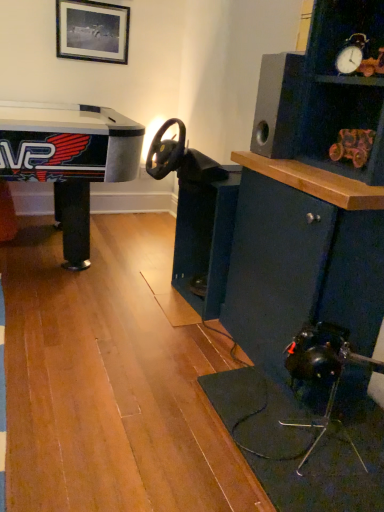
Image resolution: width=384 pixels, height=512 pixels. What do you see at coordinates (92, 31) in the screenshot?
I see `black matte picture frame at upper center` at bounding box center [92, 31].

The image size is (384, 512). Describe the element at coordinates (205, 239) in the screenshot. I see `dark blue wood cabinet at center` at that location.

The height and width of the screenshot is (512, 384). Describe the element at coordinates (278, 105) in the screenshot. I see `black matte speaker at upper right` at that location.

Where is `black matte speaker at upper right`? black matte speaker at upper right is located at coordinates (278, 105).

In order to click on black matte picture frame at upper center in this screenshot , I will do `click(92, 31)`.

From the picture: Is black matte speaker at upper right oriented towards dark blue wood cabinet at center?

No.

Is black matte speaker at upper right with dark blue wood cabinet at center?

They are not placed beside each other.

From the image's perspective, is black matte speaker at upper right located above dark blue wood cabinet at center?

Yes, from the image's perspective, black matte speaker at upper right is on top of dark blue wood cabinet at center.

From a real-world perspective, is black matte speaker at upper right on dark blue wood cabinet at center?

Yes.

From the image's perspective, does dark blue wood cabinet at center appear higher than black matte speaker at upper right?

Incorrect, from the image's perspective, dark blue wood cabinet at center is lower than black matte speaker at upper right.

Is dark blue wood cabinet at center turned away from black matte speaker at upper right?

dark blue wood cabinet at center does not have its back to black matte speaker at upper right.

Between dark blue wood cabinet at center and black matte speaker at upper right, which one has less height?

With less height is black matte speaker at upper right.

From a real-world perspective, is dark blue wood cabinet at center located higher than black matte speaker at upper right?

No.

Which is more to the right, black matte speaker at upper right or wooden toy car at upper right?

wooden toy car at upper right is more to the right.

Is black matte speaker at upper right located outside wooden toy car at upper right?

black matte speaker at upper right is positioned outside wooden toy car at upper right.

At what (x,y) coordinates should I click in order to perform the action: click on toy directly beneath the black matte speaker at upper right (from a real-world perspective). Please return your answer as a coordinate pair (x, y). The image size is (384, 512). Looking at the image, I should click on (353, 146).

Which is behind, black matte speaker at upper right or wooden toy car at upper right?

black matte speaker at upper right is further away from the camera.

Is dark blue wood cabinet at center far away from black matte picture frame at upper center?

Absolutely, dark blue wood cabinet at center is distant from black matte picture frame at upper center.

Can you confirm if dark blue wood cabinet at center is wider than black matte picture frame at upper center?

Correct, the width of dark blue wood cabinet at center exceeds that of black matte picture frame at upper center.

From the image's perspective, is dark blue wood cabinet at center on black matte picture frame at upper center?

No, from the image's perspective, dark blue wood cabinet at center is not on top of black matte picture frame at upper center.

Is black matte speaker at upper right shorter than black matte picture frame at upper center?

In fact, black matte speaker at upper right may be taller than black matte picture frame at upper center.

From the image's perspective, between black matte speaker at upper right and black matte picture frame at upper center, who is located below?

black matte speaker at upper right.

In terms of size, does black matte speaker at upper right appear bigger or smaller than black matte picture frame at upper center?

In the image, black matte speaker at upper right appears to be larger than black matte picture frame at upper center.

At what (x,y) coordinates should I click in order to perform the action: click on picture frame on the left of black matte speaker at upper right. Please return your answer as a coordinate pair (x, y). This screenshot has height=512, width=384. Looking at the image, I should click on (92, 31).

Is black matte picture frame at upper center located outside black matte speaker at upper right?

Yes, black matte picture frame at upper center is located beyond the bounds of black matte speaker at upper right.

Can you confirm if black matte picture frame at upper center is bigger than black matte speaker at upper right?

No, black matte picture frame at upper center is not bigger than black matte speaker at upper right.

From the image's perspective, which object appears higher, black matte picture frame at upper center or black matte speaker at upper right?

black matte picture frame at upper center.

In the scene shown: From a real-world perspective, between black matte picture frame at upper center and black matte speaker at upper right, who is vertically higher?

From a 3D spatial view, black matte picture frame at upper center is above.

Locate an element on the screen. This screenshot has width=384, height=512. picture frame above the wooden toy car at upper right (from the image's perspective) is located at coordinates (92, 31).

Does wooden toy car at upper right touch black matte picture frame at upper center?

No, wooden toy car at upper right is not touching black matte picture frame at upper center.

Is wooden toy car at upper right facing away from black matte picture frame at upper center?

wooden toy car at upper right does not have its back to black matte picture frame at upper center.

The height and width of the screenshot is (512, 384). In order to click on speaker in front of the dark blue wood cabinet at center in this screenshot , I will do coord(278,105).

Find the location of a particular element. speaker above the dark blue wood cabinet at center (from the image's perspective) is located at coordinates (278, 105).

Based on their spatial positions, is wooden toy car at upper right or black matte picture frame at upper center further from dark blue wood cabinet at center?

The object further to dark blue wood cabinet at center is black matte picture frame at upper center.

Estimate the real-world distances between objects in this image. Which object is further from dark blue wood cabinet at center, black matte speaker at upper right or wooden toy car at upper right?

wooden toy car at upper right lies further to dark blue wood cabinet at center than the other object.

From the image, which object appears to be farther from dark blue wood cabinet at center, black matte picture frame at upper center or black matte speaker at upper right?

black matte picture frame at upper center is further to dark blue wood cabinet at center.

Based on their spatial positions, is black matte picture frame at upper center or dark blue wood cabinet at center further from wooden toy car at upper right?

black matte picture frame at upper center is positioned further to the anchor wooden toy car at upper right.

Considering their positions, is wooden toy car at upper right positioned closer to black matte speaker at upper right than dark blue wood cabinet at center?

wooden toy car at upper right is closer to black matte speaker at upper right.

Consider the image. When comparing their distances from black matte speaker at upper right, does dark blue wood cabinet at center or wooden toy car at upper right seem further?

The object further to black matte speaker at upper right is dark blue wood cabinet at center.

In the scene shown: When comparing their distances from black matte picture frame at upper center, does dark blue wood cabinet at center or black matte speaker at upper right seem further?

black matte speaker at upper right.

In the scene shown: Considering their positions, is dark blue wood cabinet at center positioned further to wooden toy car at upper right than black matte speaker at upper right?

dark blue wood cabinet at center lies further to wooden toy car at upper right than the other object.

This screenshot has height=512, width=384. In order to click on toy between black matte picture frame at upper center and dark blue wood cabinet at center in the up-down direction in this screenshot , I will do `click(353, 146)`.

You are a GUI agent. You are given a task and a screenshot of the screen. Output one action in this format:
    pyautogui.click(x=<x>, y=<y>)
    Task: Click on the speaker between wooden toy car at upper right and black matte picture frame at upper center from front to back
    This screenshot has width=384, height=512.
    Given the screenshot: What is the action you would take?
    pyautogui.click(x=278, y=105)

Locate an element on the screen. The width and height of the screenshot is (384, 512). toy between black matte speaker at upper right and dark blue wood cabinet at center in the vertical direction is located at coordinates (353, 146).

The height and width of the screenshot is (512, 384). In order to click on speaker between black matte picture frame at upper center and dark blue wood cabinet at center from top to bottom in this screenshot , I will do `click(278, 105)`.